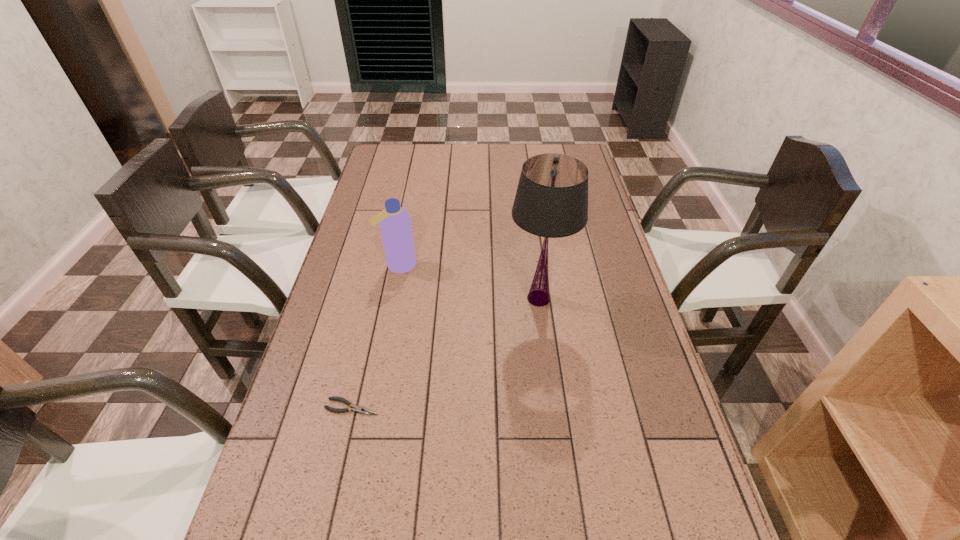
Locate an element on the screen. This screenshot has height=540, width=960. vacant point located between the pliers and the shampoo is located at coordinates (375, 336).

The width and height of the screenshot is (960, 540). Identify the location of vacant area that lies between the tallest object and the shampoo. (468, 282).

The image size is (960, 540). I want to click on object identified as the closest to the shortest object, so click(551, 201).

Find the location of a particular element. The image size is (960, 540). object identified as the closest to the nearest object is located at coordinates (551, 201).

Locate an element on the screen. vacant region that satisfies the following two spatial constraints: 1. on the front-facing side of the second farthest object; 2. on the front side of the pliers is located at coordinates (553, 407).

This screenshot has height=540, width=960. Find the location of `vacant region that satisfies the following two spatial constraints: 1. on the front-facing side of the tallest object; 2. on the front side of the nearest object`. vacant region that satisfies the following two spatial constraints: 1. on the front-facing side of the tallest object; 2. on the front side of the nearest object is located at coordinates coord(553,407).

Where is `vacant area in the image that satisfies the following two spatial constraints: 1. on the back side of the nearest object; 2. on the right side of the second tallest object`? The width and height of the screenshot is (960, 540). vacant area in the image that satisfies the following two spatial constraints: 1. on the back side of the nearest object; 2. on the right side of the second tallest object is located at coordinates (385, 265).